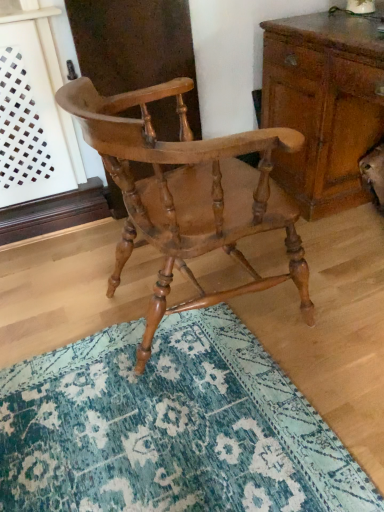
Question: Based on their positions, is wooden chest of drawers at right located to the left or right of light brown wood chair at center?

Choices:
 (A) left
 (B) right

Answer: (B)

Question: In the image, is wooden chest of drawers at right positioned in front of or behind light brown wood chair at center?

Choices:
 (A) behind
 (B) front

Answer: (A)

Question: Which object is positioned closest to the teal textured rug at center?

Choices:
 (A) wooden chest of drawers at right
 (B) light brown wood chair at center

Answer: (B)

Question: Based on their relative distances, which object is nearer to the wooden chest of drawers at right?

Choices:
 (A) light brown wood chair at center
 (B) teal textured rug at center

Answer: (A)